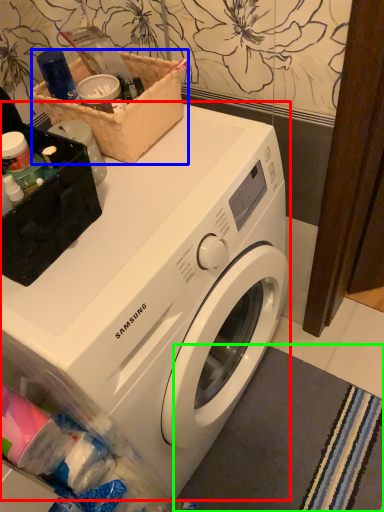
Question: Based on their relative distances, which object is nearer to washing machine (highlighted by a red box)? Choose from basket (highlighted by a blue box) and bath mat (highlighted by a green box).

Choices:
 (A) basket
 (B) bath mat

Answer: (A)